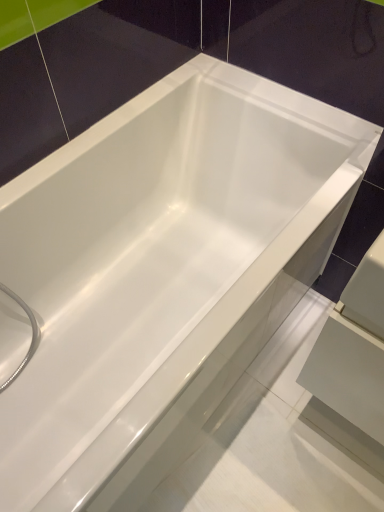
What do you see at coordinates (348, 374) in the screenshot?
I see `satin gray drawer at lower right` at bounding box center [348, 374].

At what (x,y) coordinates should I click in order to perform the action: click on satin gray drawer at lower right. Please return your answer as a coordinate pair (x, y). Looking at the image, I should click on (348, 374).

Identify the location of satin gray drawer at lower right. Image resolution: width=384 pixels, height=512 pixels. (348, 374).